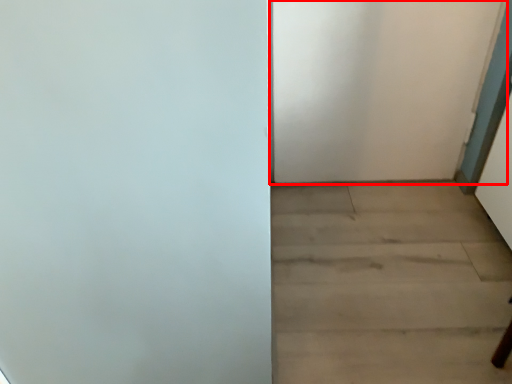
Question: Considering the relative positions of door (annotated by the red box) and stairwell in the image provided, where is door (annotated by the red box) located with respect to the staircase?

Choices:
 (A) left
 (B) right

Answer: (A)